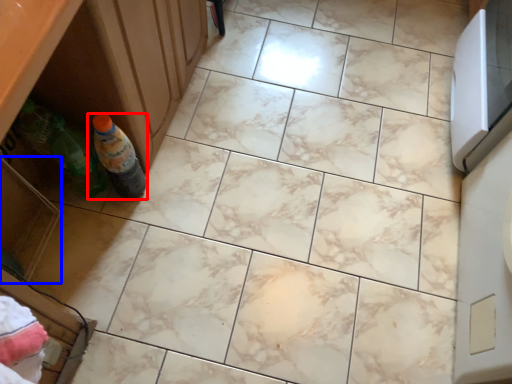
Question: Among these objects, which one is nearest to the camera, bottle (highlighted by a red box) or drawer (highlighted by a blue box)?

Choices:
 (A) bottle
 (B) drawer

Answer: (B)